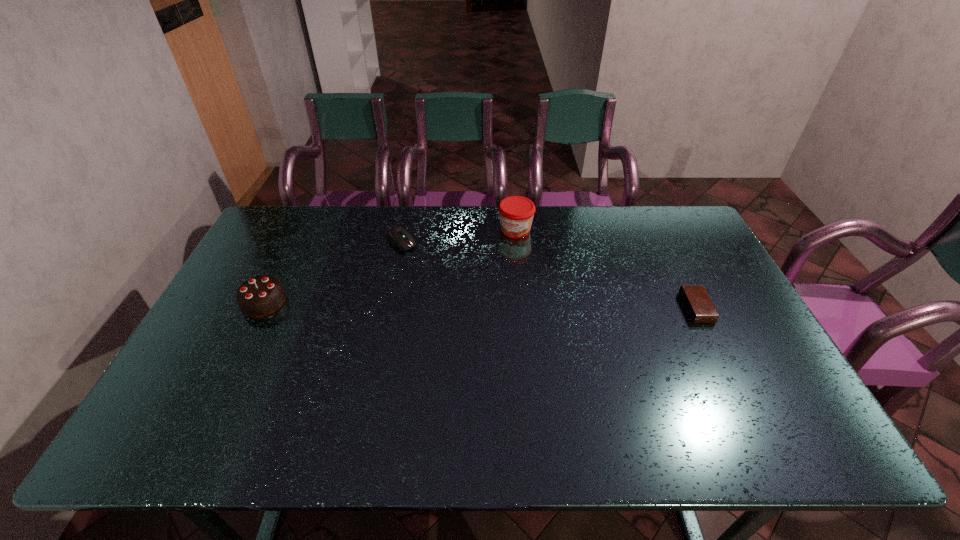
The height and width of the screenshot is (540, 960). Find the location of `the leftmost object`. the leftmost object is located at coordinates (260, 296).

This screenshot has height=540, width=960. What are the coordinates of `the rightmost object` in the screenshot? It's located at tap(697, 302).

Where is `the shortest object`? Image resolution: width=960 pixels, height=540 pixels. the shortest object is located at coordinates (697, 302).

Locate an element on the screen. The height and width of the screenshot is (540, 960). the third object from left to right is located at coordinates (516, 213).

The width and height of the screenshot is (960, 540). Find the location of `the third tallest object`. the third tallest object is located at coordinates click(398, 236).

This screenshot has width=960, height=540. In order to click on computer equipment in this screenshot , I will do `click(398, 236)`.

The width and height of the screenshot is (960, 540). I want to click on vacant space located 0.210m on the back of the leftmost object, so click(x=293, y=244).

I want to click on vacant space located on the front face of the rightmost object, so pyautogui.click(x=725, y=307).

Locate an element on the screen. This screenshot has width=960, height=540. vacant space positioned on the label side of the jam is located at coordinates (487, 282).

Find the location of a particular element. vacant region located 0.220m on the label side of the jam is located at coordinates (487, 282).